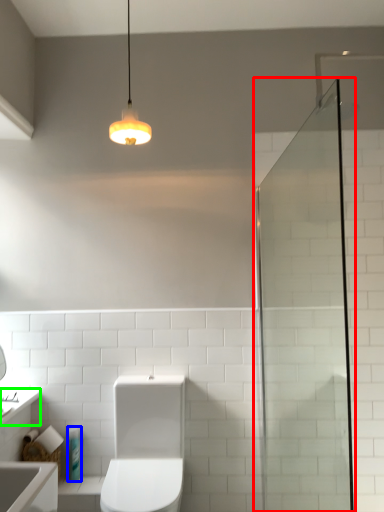
Question: Estimate the real-world distances between objects in this image. Which object is closer to screen door (highlighted by a red box), toiletry (highlighted by a blue box) or counter top (highlighted by a green box)?

Choices:
 (A) toiletry
 (B) counter top

Answer: (A)